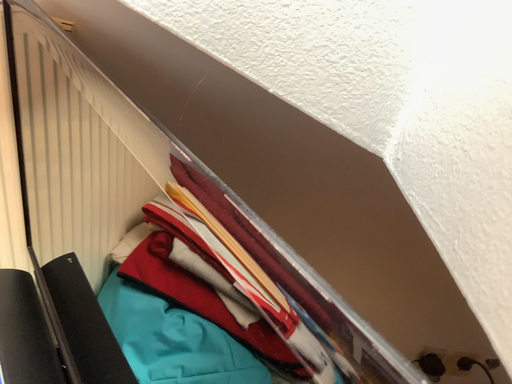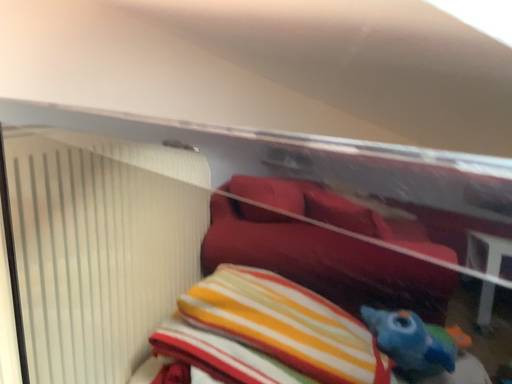
Question: How did the camera likely rotate when shooting the video?

Choices:
 (A) rotated downward
 (B) rotated upward

Answer: (B)